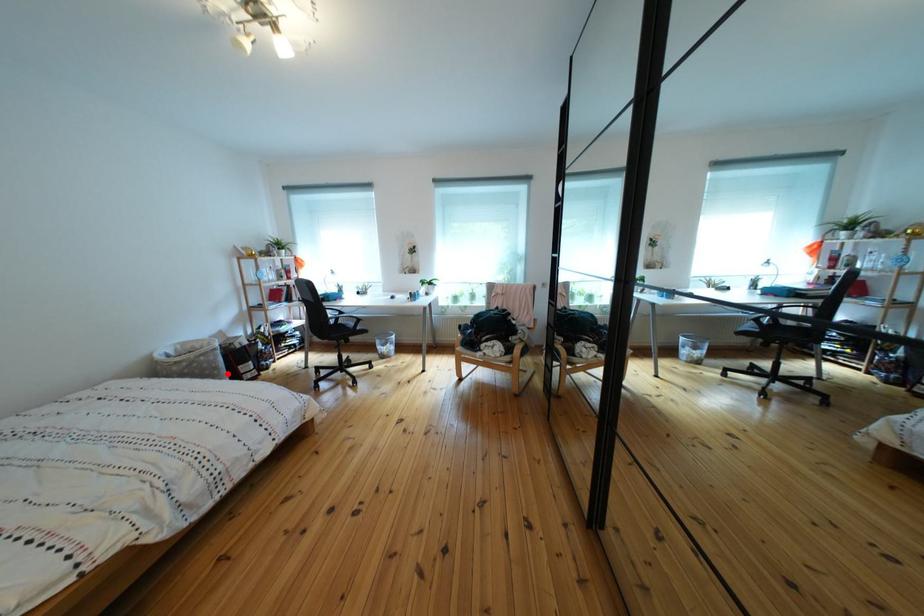
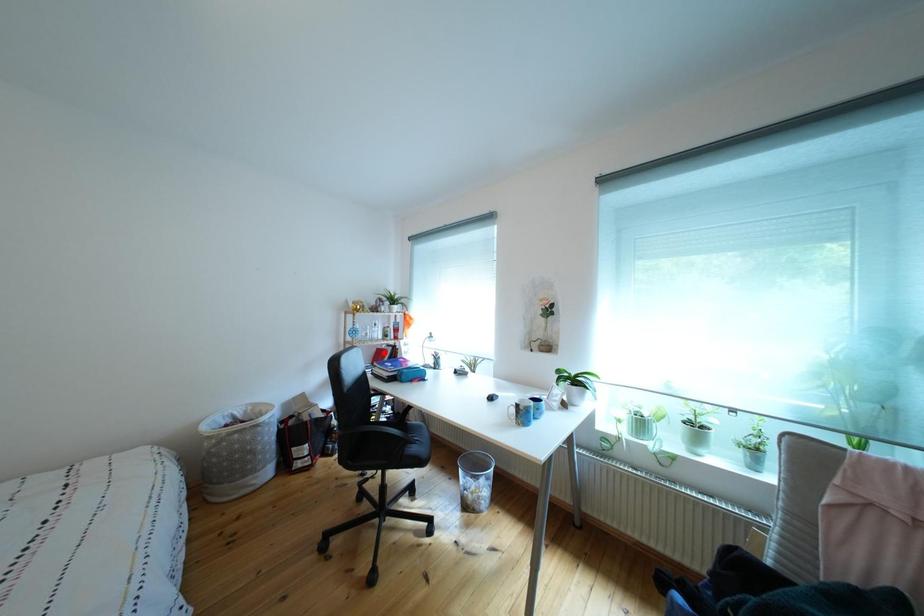
I am providing you with two images of the same scene from different viewpoints. A red point is marked on the first image and another point is marked on the second image. Do the highlighted points in image1 and image2 indicate the same real-world spot?

No